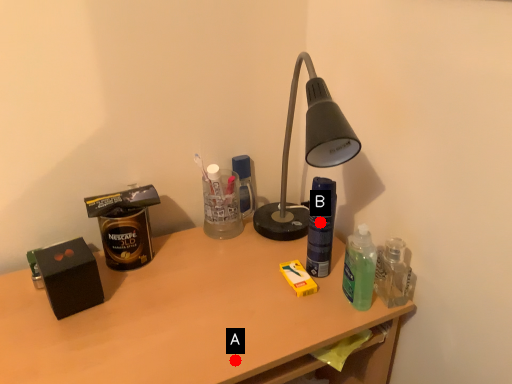
Question: Two points are circled on the image, labeled by A and B beside each circle. Which point appears closest to the camera in this image?

Choices:
 (A) A is closer
 (B) B is closer

Answer: (A)